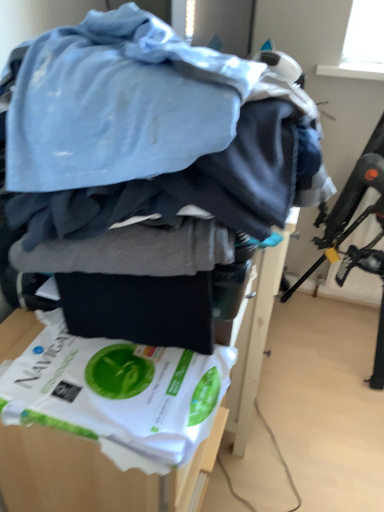
Question: Is black plastic swivel chair at upper right outside white paper at lower left?

Choices:
 (A) yes
 (B) no

Answer: (A)

Question: From a real-world perspective, is black plastic swivel chair at upper right on white paper at lower left?

Choices:
 (A) yes
 (B) no

Answer: (B)

Question: From the image's perspective, is black plastic swivel chair at upper right over white paper at lower left?

Choices:
 (A) yes
 (B) no

Answer: (A)

Question: Does black plastic swivel chair at upper right lie in front of white paper at lower left?

Choices:
 (A) yes
 (B) no

Answer: (B)

Question: Is black plastic swivel chair at upper right positioned far away from white paper at lower left?

Choices:
 (A) no
 (B) yes

Answer: (B)

Question: Is point (97, 339) closer or farther from the camera than point (319, 260)?

Choices:
 (A) closer
 (B) farther

Answer: (A)

Question: In terms of height, does white paper at lower left look taller or shorter compared to black plastic swivel chair at upper right?

Choices:
 (A) short
 (B) tall

Answer: (A)

Question: From the image's perspective, is white paper at lower left above or below black plastic swivel chair at upper right?

Choices:
 (A) above
 (B) below

Answer: (B)

Question: Looking at their shapes, would you say white paper at lower left is wider or thinner than black plastic swivel chair at upper right?

Choices:
 (A) thin
 (B) wide

Answer: (A)

Question: Do you think white paper at lower left is within white paper bag at center, or outside of it?

Choices:
 (A) inside
 (B) outside

Answer: (B)

Question: In terms of height, does white paper at lower left look taller or shorter compared to white paper bag at center?

Choices:
 (A) tall
 (B) short

Answer: (B)

Question: In the image, is white paper at lower left positioned in front of or behind white paper bag at center?

Choices:
 (A) behind
 (B) front

Answer: (B)

Question: Considering the positions of point (4, 386) and point (82, 441), is point (4, 386) closer or farther from the camera than point (82, 441)?

Choices:
 (A) closer
 (B) farther

Answer: (A)

Question: Do you think white paper bag at center is within white paper at lower left, or outside of it?

Choices:
 (A) outside
 (B) inside

Answer: (A)

Question: Based on their sizes in the image, would you say white paper bag at center is bigger or smaller than white paper at lower left?

Choices:
 (A) big
 (B) small

Answer: (A)